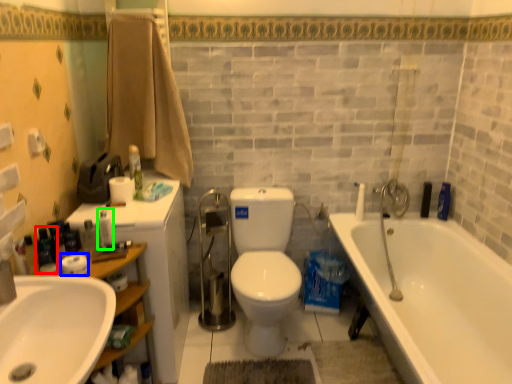
Question: Estimate the real-world distances between objects in this image. Which object is farther from toiletry (highlighted by a red box), toilet paper (highlighted by a blue box) or toiletry (highlighted by a green box)?

Choices:
 (A) toilet paper
 (B) toiletry

Answer: (B)